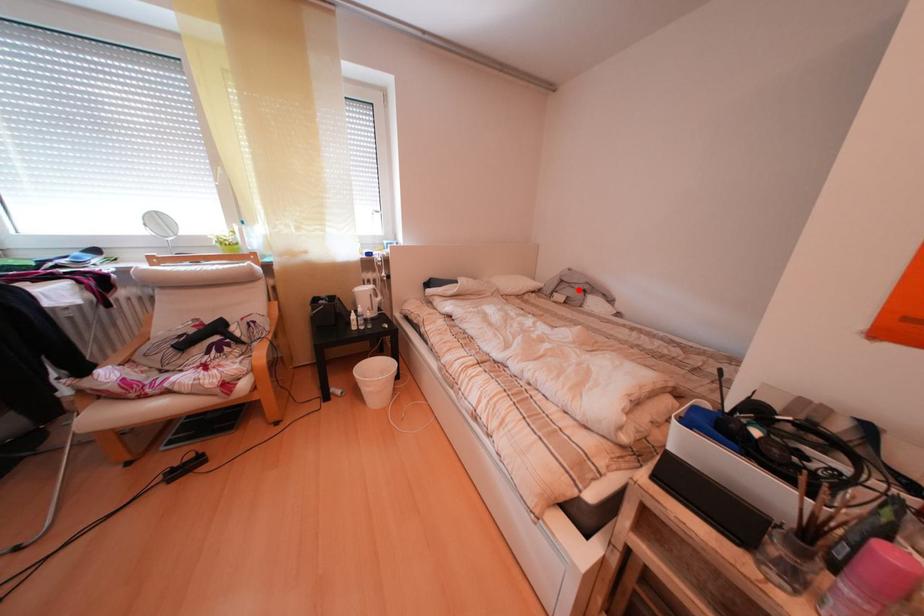
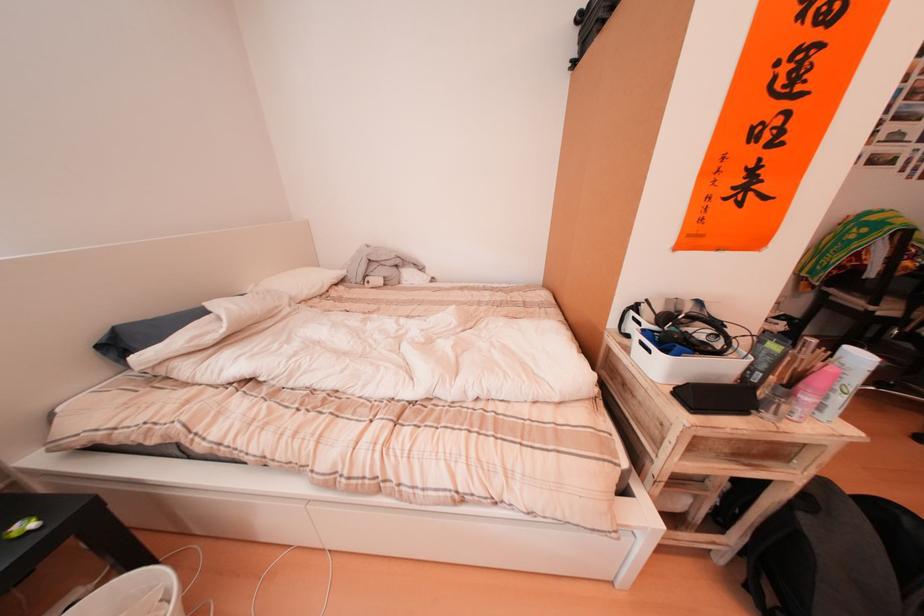
Question: I am providing you with two images of the same scene from different viewpoints. In image1, a red point is highlighted. Considering the same 3D point in image2, which of the following is correct?

Choices:
 (A) It is closer
 (B) It is farther

Answer: (A)